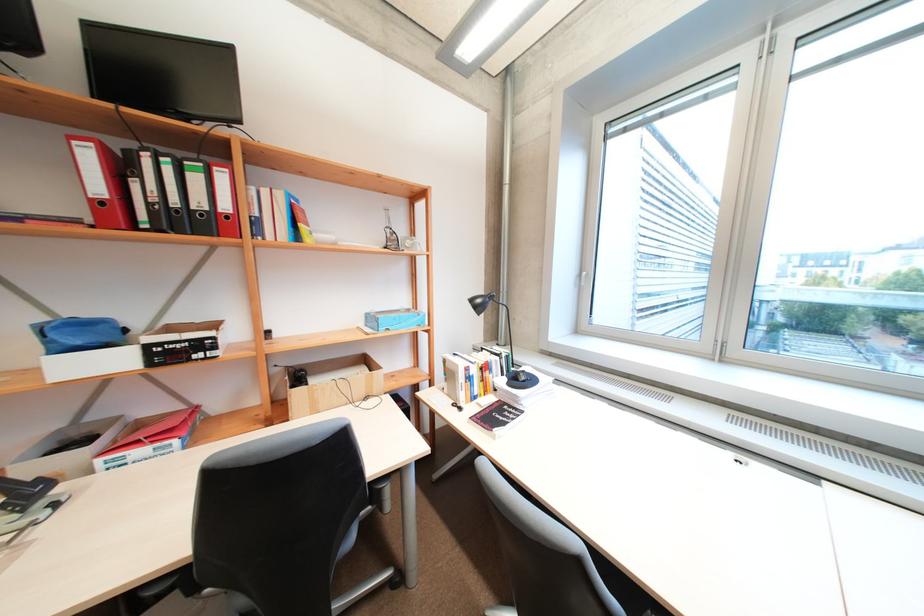
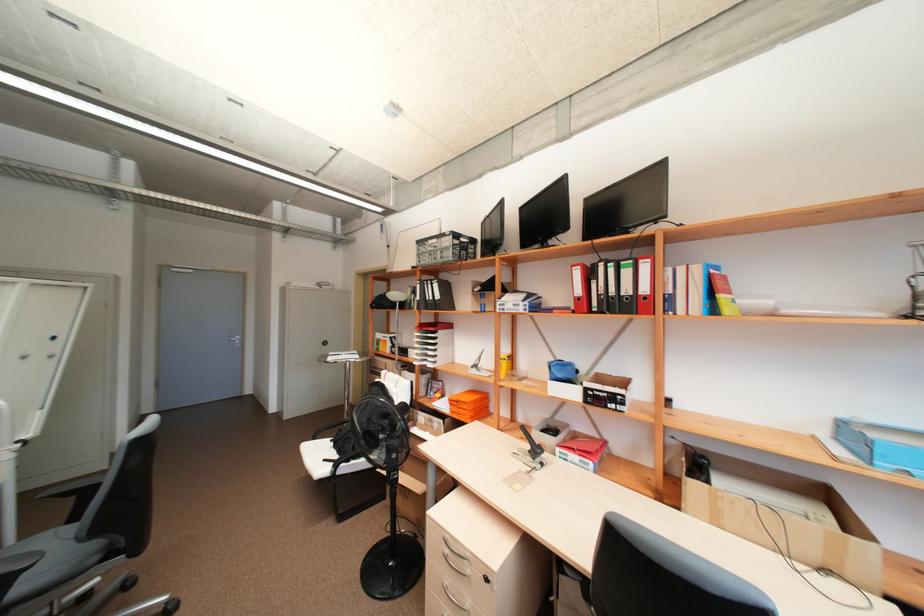
Find the pixel in the second image that matches pixel 201 177 in the first image.

(633, 273)